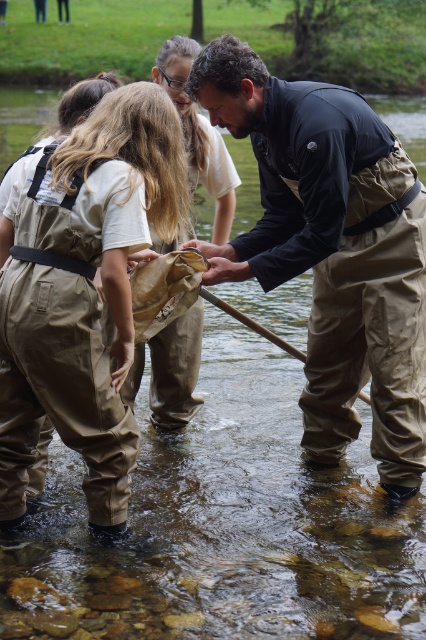
Question: Among these points, which one is farthest from the camera?

Choices:
 (A) 32,193
 (B) 187,51

Answer: (B)

Question: Estimate the real-world distances between objects in this image. Which object is farther from the matte black waders at center?

Choices:
 (A) tan waterproof overalls at center
 (B) brown suede waders at center

Answer: (B)

Question: Which object is closer to the camera taking this photo?

Choices:
 (A) matte black waders at center
 (B) tan waterproof overalls at center

Answer: (B)

Question: Is matte black waders at center in front of brown suede waders at center?

Choices:
 (A) no
 (B) yes

Answer: (B)

Question: From the image, what is the correct spatial relationship of matte black waders at center in relation to brown suede waders at center?

Choices:
 (A) left
 (B) right

Answer: (B)

Question: Is matte black waders at center to the left of brown suede waders at center from the viewer's perspective?

Choices:
 (A) no
 (B) yes

Answer: (A)